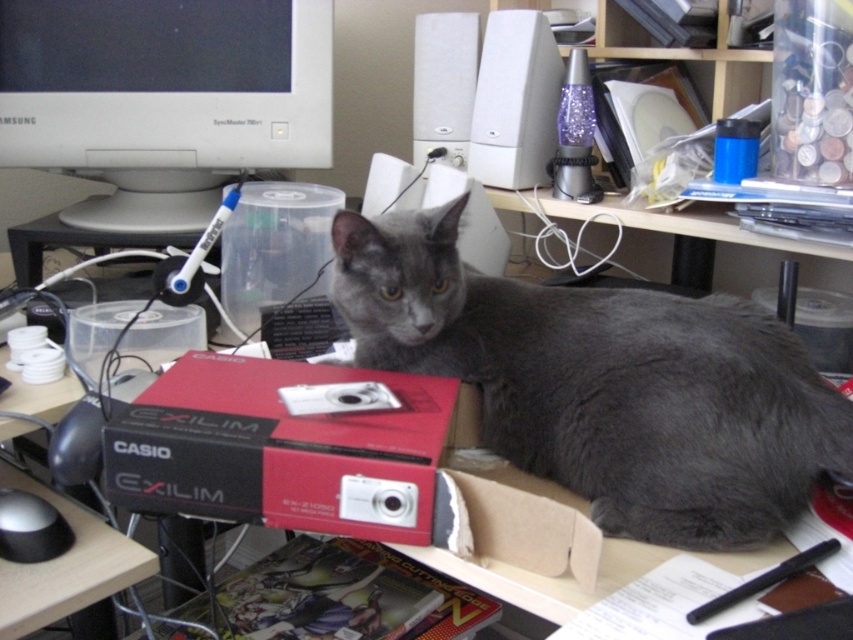
Question: Considering the relative positions of white glossy computer monitor at upper left and cardboard at lower center in the image provided, where is white glossy computer monitor at upper left located with respect to cardboard at lower center?

Choices:
 (A) above
 (B) below

Answer: (A)

Question: Which object is the farthest from the gray fur cat at center?

Choices:
 (A) white glossy computer monitor at upper left
 (B) red matte casio exilim box at center
 (C) black matte mouse at lower left
 (D) cardboard at lower center

Answer: (A)

Question: Can you confirm if gray fur cat at center is positioned below red matte casio exilim box at center?

Choices:
 (A) yes
 (B) no

Answer: (B)

Question: Which object is the farthest from the cardboard at lower center?

Choices:
 (A) black matte mouse at lower left
 (B) white glossy computer monitor at upper left

Answer: (B)

Question: Is gray fur cat at center smaller than red matte casio exilim box at center?

Choices:
 (A) no
 (B) yes

Answer: (A)

Question: Which point is closer to the camera taking this photo?

Choices:
 (A) pos(30,496)
 (B) pos(521,493)
 (C) pos(776,442)
 (D) pos(73,147)

Answer: (B)